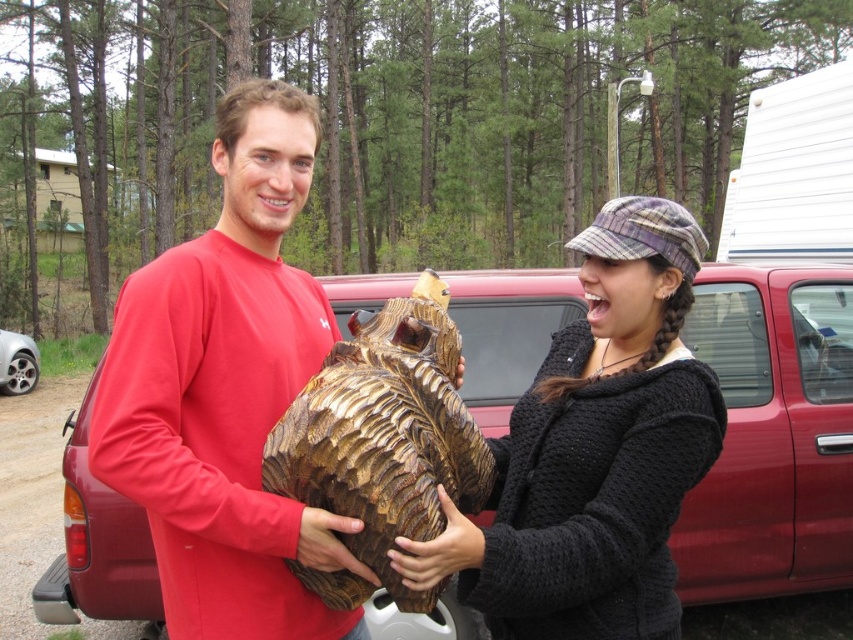
Question: Among these points, which one is farthest from the camera?

Choices:
 (A) (466, 604)
 (B) (390, 368)
 (C) (788, 476)
 (D) (4, 330)

Answer: (D)

Question: Can you confirm if wooden carving at center is smaller than silver metallic car wheel at lower left?

Choices:
 (A) yes
 (B) no

Answer: (A)

Question: Is metallic red truck at center bigger than wooden carving at center?

Choices:
 (A) no
 (B) yes

Answer: (B)

Question: Which object is farther from the camera taking this photo?

Choices:
 (A) wooden carving at center
 (B) silver metallic car wheel at lower left
 (C) black knitted sweater at center
 (D) matte red shirt at center

Answer: (B)

Question: Can you confirm if matte red shirt at center is positioned to the right of wooden carving at center?

Choices:
 (A) no
 (B) yes

Answer: (A)

Question: Among these points, which one is nearest to the camera?

Choices:
 (A) (271, 536)
 (B) (370, 355)
 (C) (691, 275)
 (D) (729, 563)

Answer: (A)